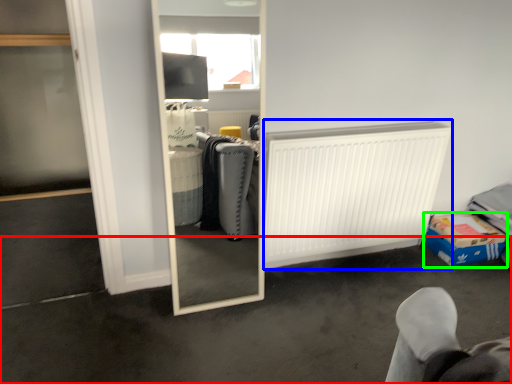
Question: Based on their relative distances, which object is farther from concrete (highlighted by a red box)? Choose from radiator (highlighted by a blue box) and cardboard box (highlighted by a green box).

Choices:
 (A) radiator
 (B) cardboard box

Answer: (B)